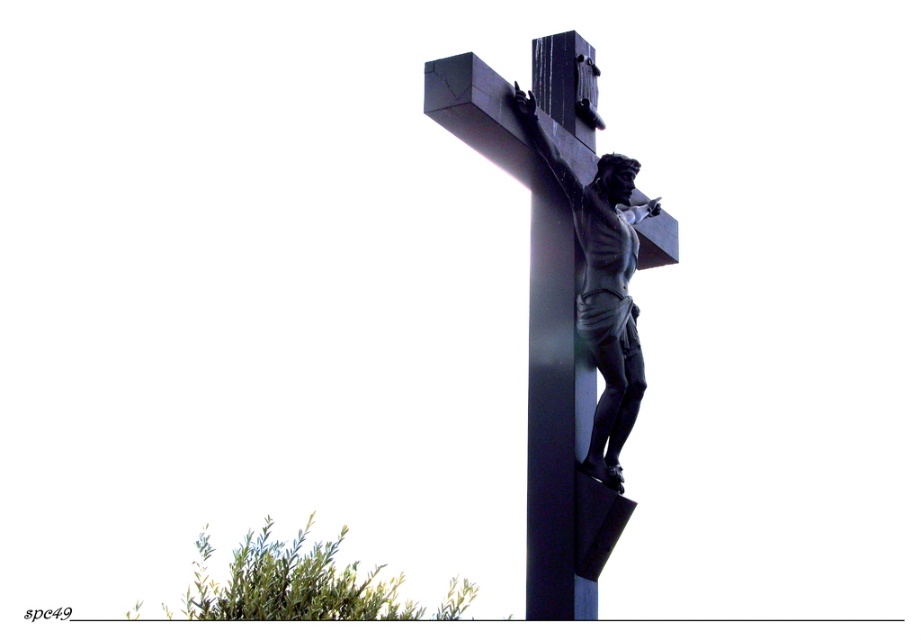
Between point (558, 330) and point (590, 262), which one is positioned behind?

The point (590, 262) is behind.

Which is more to the right, glossy dark wood pole at center or polished bronze crucifix at center?

polished bronze crucifix at center is more to the right.

This screenshot has width=921, height=640. Identify the location of glossy dark wood pole at center. (556, 422).

Where is `glossy dark wood pole at center`? glossy dark wood pole at center is located at coordinates (556, 422).

Locate an element on the screen. black polished cross at center is located at coordinates (541, 353).

Does black polished cross at center have a greater height compared to polished bronze crucifix at center?

Correct, black polished cross at center is much taller as polished bronze crucifix at center.

Identify the location of black polished cross at center. (541, 353).

Identify the location of black polished cross at center. (541, 353).

Does black polished cross at center have a larger size compared to glossy dark wood pole at center?

Indeed, black polished cross at center has a larger size compared to glossy dark wood pole at center.

Which is above, black polished cross at center or glossy dark wood pole at center?

glossy dark wood pole at center is higher up.

Is point (554, 481) positioned after point (543, 432)?

No, (554, 481) is closer to viewer.

Find the location of a particular element. The image size is (921, 640). black polished cross at center is located at coordinates (541, 353).